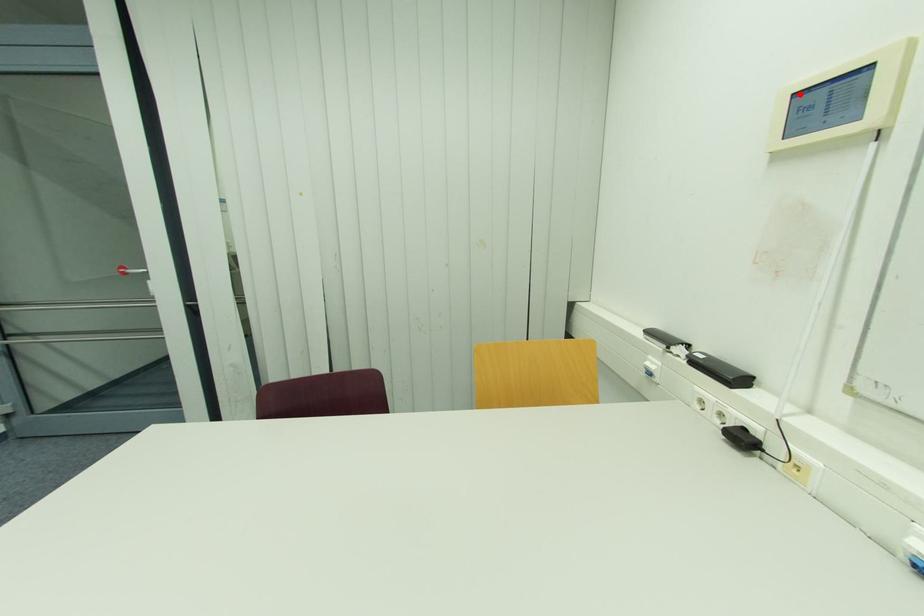
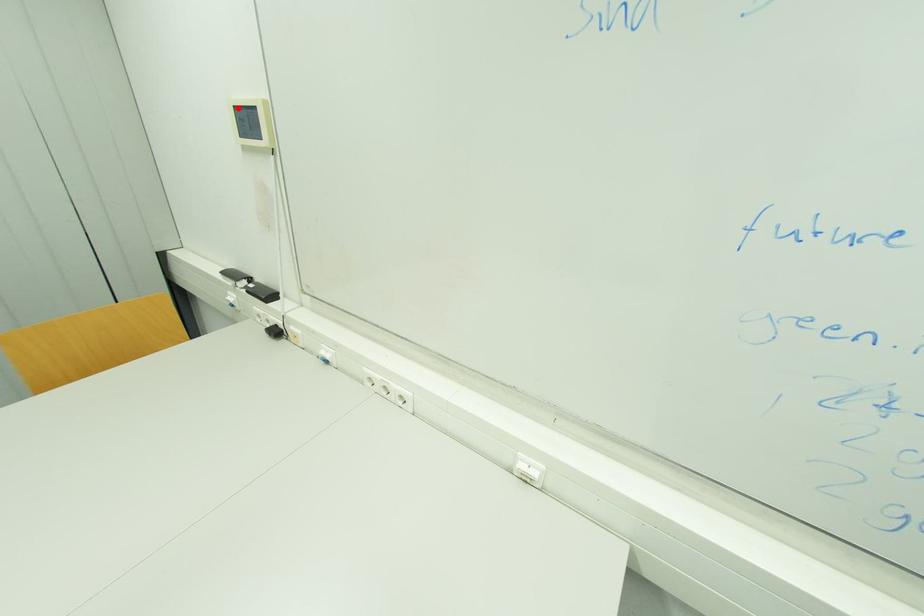
I am providing you with two images of the same scene from different viewpoints. A red point is marked on the first image and another point is marked on the second image. Does the point marked in image1 correspond to the same location as the one in image2?

Yes